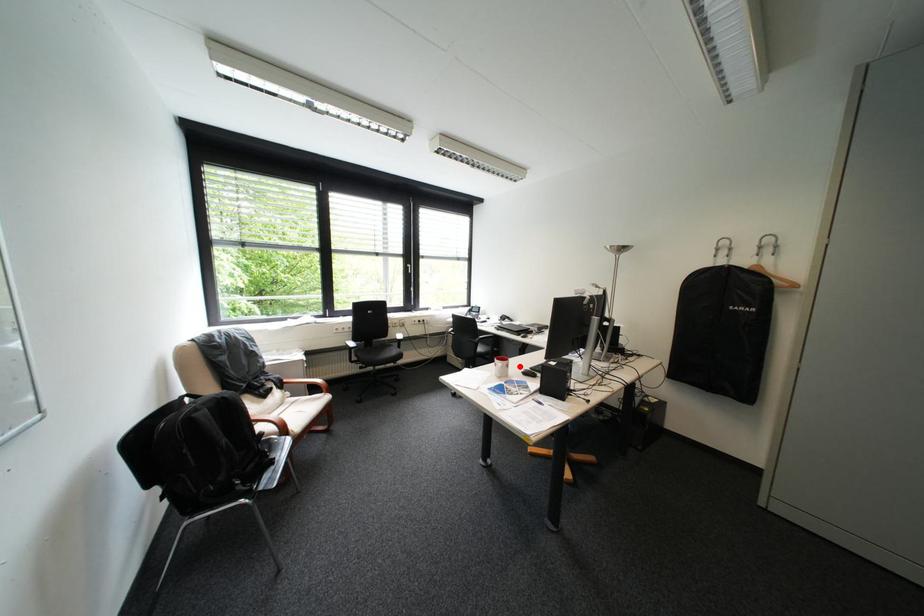
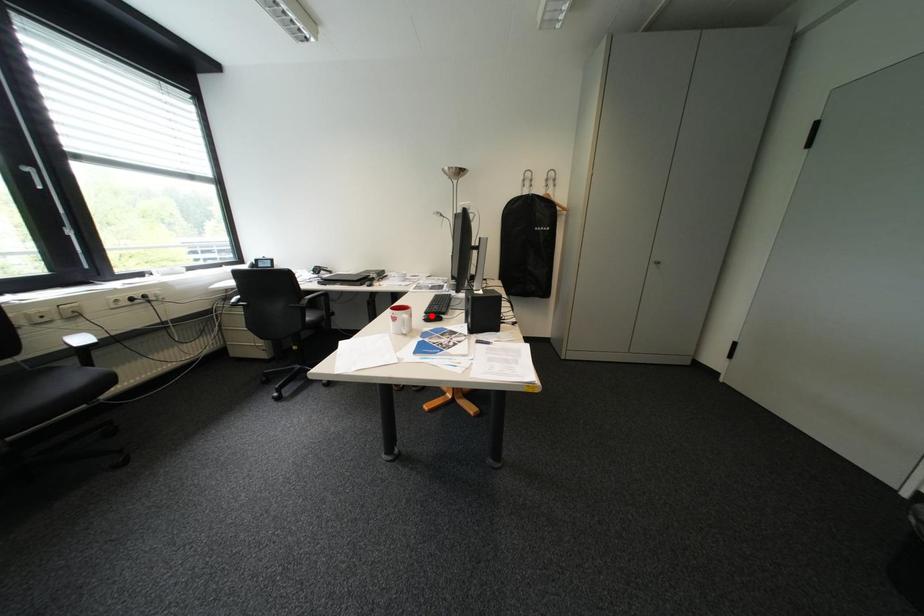
I am providing you with two images of the same scene from different viewpoints. A red point is marked on the first image and another point is marked on the second image. Is the red point in image1 aligned with the point shown in image2?

No